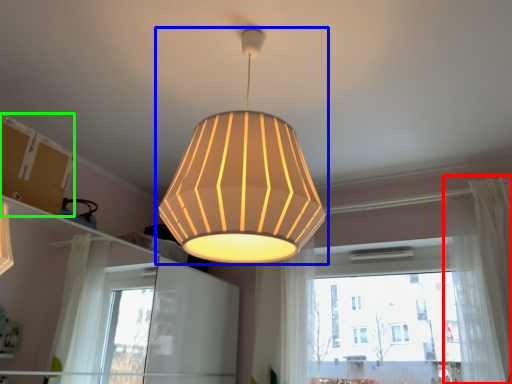
Question: Which object is the farthest from curtain (highlighted by a red box)? Choose among these: lamp (highlighted by a blue box) or cardboard box (highlighted by a green box).

Choices:
 (A) lamp
 (B) cardboard box

Answer: (B)